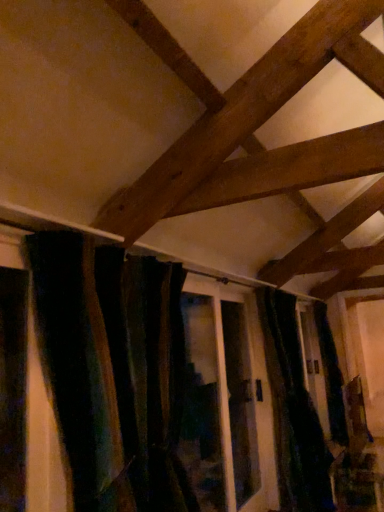
Question: Is translucent glass screen door at center in front of or behind velvet dark green curtain at center, the 1th curtain positioned from the front, in the image?

Choices:
 (A) behind
 (B) front

Answer: (A)

Question: From a real-world perspective, relative to velvet dark green curtain at center, which is the second curtain in right-to-left order, is translucent glass screen door at center vertically above or below?

Choices:
 (A) above
 (B) below

Answer: (B)

Question: Considering the real-world distances, which object is closest to the velvet dark green curtain at center, the 1th curtain positioned from the front?

Choices:
 (A) velvet dark green curtain at center, acting as the second curtain starting from the front
 (B) translucent glass screen door at center

Answer: (B)

Question: Which is nearer to the translucent glass screen door at center?

Choices:
 (A) velvet dark green curtain at center, which is the second curtain in left-to-right order
 (B) velvet dark green curtain at center, which is the second curtain in right-to-left order

Answer: (A)